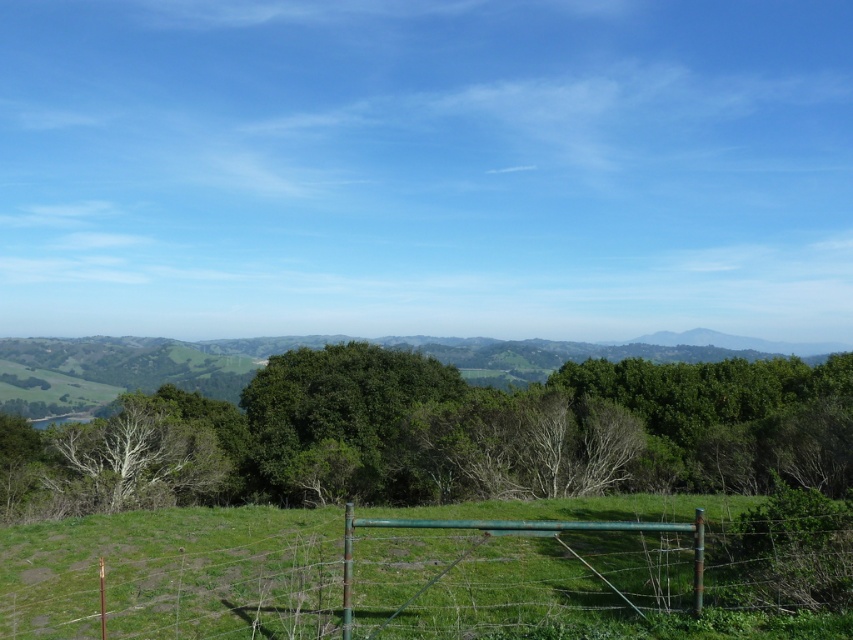
Question: Among these objects, which one is nearest to the camera?

Choices:
 (A) green metal gate at center
 (B) green leafy tree at center

Answer: (A)

Question: Is green leafy tree at center to the right of green metal gate at center from the viewer's perspective?

Choices:
 (A) yes
 (B) no

Answer: (B)

Question: Which point is farther to the camera?

Choices:
 (A) green leafy tree at center
 (B) green metal gate at center

Answer: (A)

Question: Does green leafy tree at center come behind green metal gate at center?

Choices:
 (A) yes
 (B) no

Answer: (A)

Question: Does green leafy tree at center have a lesser width compared to green metal gate at center?

Choices:
 (A) no
 (B) yes

Answer: (A)